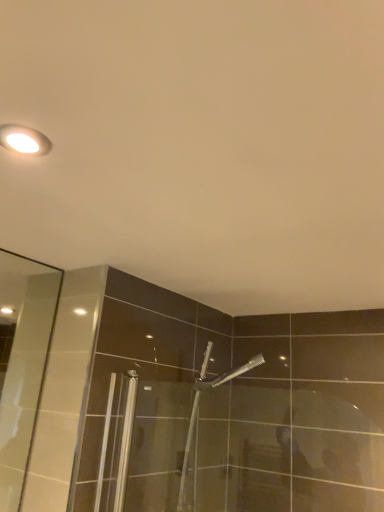
Question: From the image's perspective, is silver metallic shower head at center above or below matte white light fixture at upper left?

Choices:
 (A) above
 (B) below

Answer: (B)

Question: Do you think silver metallic shower head at center is within matte white light fixture at upper left, or outside of it?

Choices:
 (A) outside
 (B) inside

Answer: (A)

Question: Considering the positions of silver metallic shower head at center and matte white light fixture at upper left in the image, is silver metallic shower head at center taller or shorter than matte white light fixture at upper left?

Choices:
 (A) tall
 (B) short

Answer: (A)

Question: From the image's perspective, is matte white light fixture at upper left located above or below silver metallic shower head at center?

Choices:
 (A) above
 (B) below

Answer: (A)

Question: Is matte white light fixture at upper left spatially inside silver metallic shower head at center, or outside of it?

Choices:
 (A) outside
 (B) inside

Answer: (A)

Question: In terms of height, does matte white light fixture at upper left look taller or shorter compared to silver metallic shower head at center?

Choices:
 (A) tall
 (B) short

Answer: (B)

Question: In terms of width, does matte white light fixture at upper left look wider or thinner when compared to silver metallic shower head at center?

Choices:
 (A) wide
 (B) thin

Answer: (B)